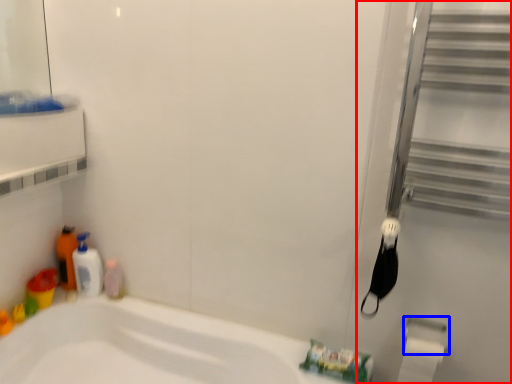
Question: Which of the following is the farthest to the observer, screen door (highlighted by a red box) or towel bar (highlighted by a blue box)?

Choices:
 (A) screen door
 (B) towel bar

Answer: (B)